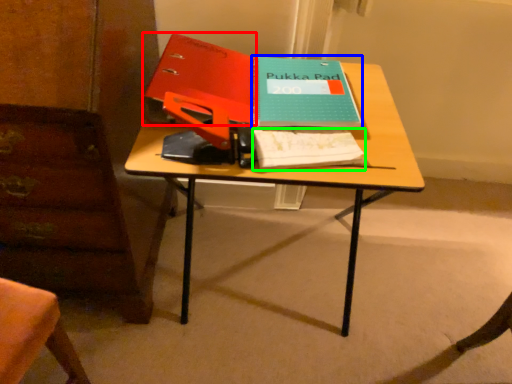
Question: Which is farther away from paperback book (highlighted by a red box)? paperback book (highlighted by a blue box) or notebook (highlighted by a green box)?

Choices:
 (A) paperback book
 (B) notebook

Answer: (B)